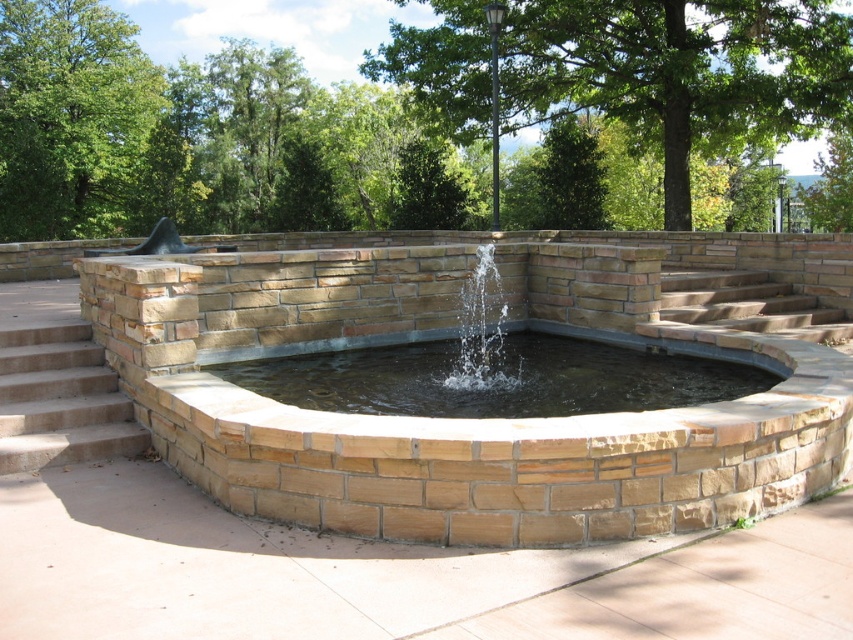
Is concrete stairs at lower left wider than clear water fountain at center?

Yes.

Does concrete stairs at lower left have a greater height compared to clear water fountain at center?

No.

Is point (80, 403) less distant than point (508, 307)?

Yes.

Where is `concrete stairs at lower left`? The height and width of the screenshot is (640, 853). concrete stairs at lower left is located at coordinates (61, 400).

Does brown stone fountain at center have a greater width compared to concrete stairs at lower left?

In fact, brown stone fountain at center might be narrower than concrete stairs at lower left.

Which is below, brown stone fountain at center or concrete stairs at lower left?

brown stone fountain at center

You are a GUI agent. You are given a task and a screenshot of the screen. Output one action in this format:
    pyautogui.click(x=<x>, y=<y>)
    Task: Click on the brown stone fountain at center
    
    Given the screenshot: What is the action you would take?
    pyautogui.click(x=473, y=419)

Who is taller, brown stone fountain at center or clear stone pool at center?

clear stone pool at center

Between brown stone fountain at center and clear stone pool at center, which one appears on the left side from the viewer's perspective?

From the viewer's perspective, clear stone pool at center appears more on the left side.

The width and height of the screenshot is (853, 640). What do you see at coordinates (473, 419) in the screenshot?
I see `brown stone fountain at center` at bounding box center [473, 419].

Locate an element on the screen. This screenshot has width=853, height=640. brown stone fountain at center is located at coordinates coord(473,419).